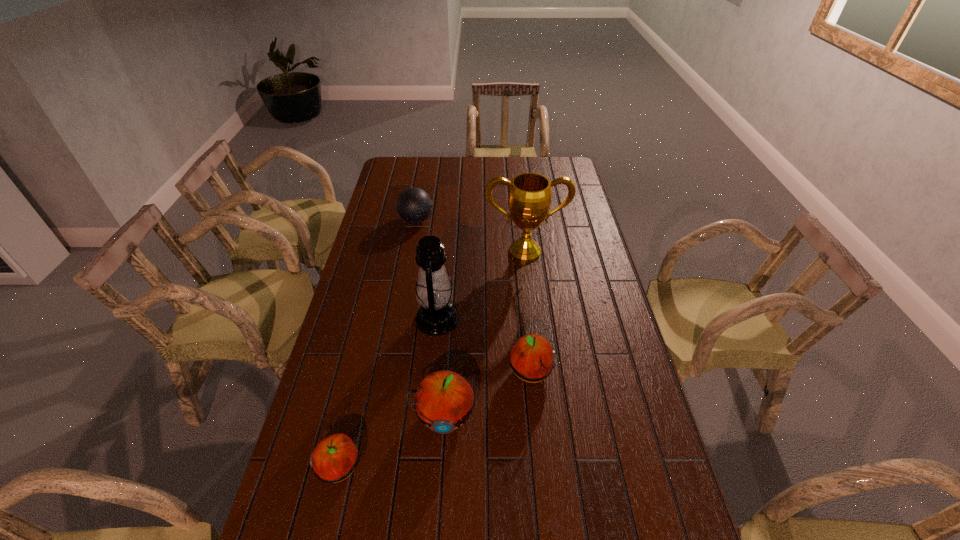
All apples are currently evenly spaced. To continue this pattern, where would you add another apple on the right? Please point out a vacant spot. Please provide its 2D coordinates. Your answer should be formatted as a tuple, i.e. [(x, y)], where the tuple contains the x and y coordinates of a point satisfying the conditions above.

[(605, 337)]